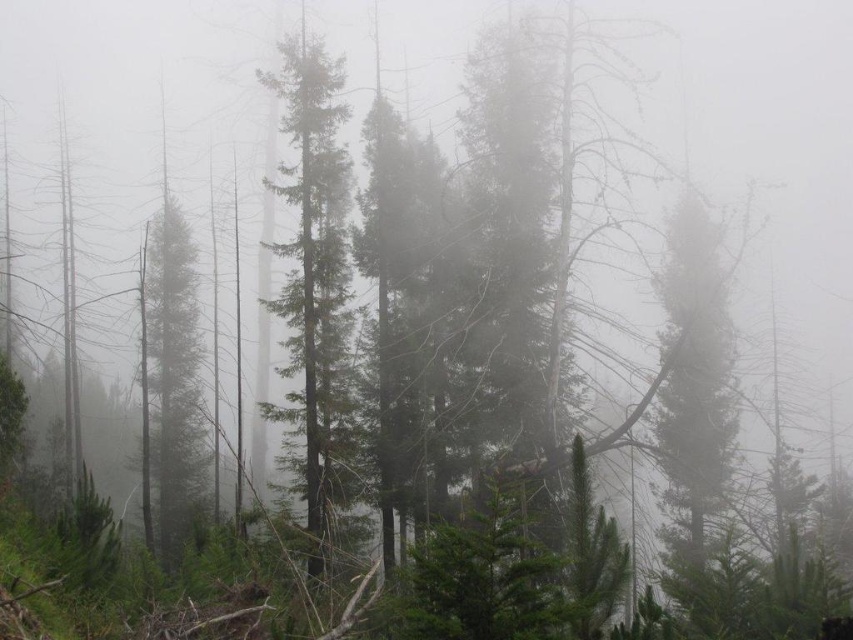
You are a hiker lost in a foggy forest. You see two trees ahead of you. One is the green textured tree at right and the other is the green textured tree at center. Which tree is positioned more to the right side?

The green textured tree at right is positioned more to the right side than the green textured tree at center.

You are a hiker lost in a foggy forest. You see two trees ahead of you, the green textured tree at right and the green textured tree at center. Which tree is taller?

The green textured tree at center is taller than the green textured tree at right.